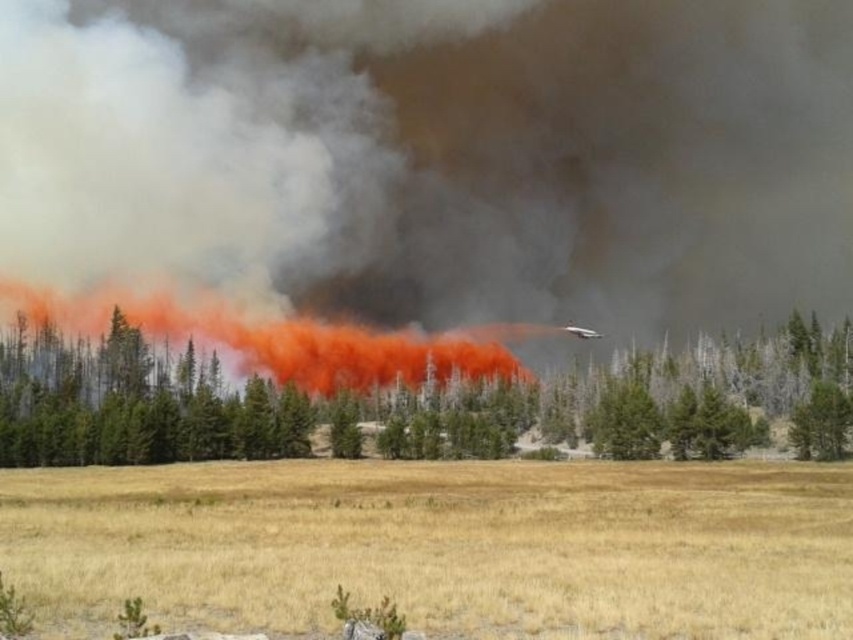
You are a firefighter assessing the fire spread. You see the dry grass at lower center and the orange smoke at center. Which area has a wider spread?

The orange smoke at center has a wider spread than the dry grass at lower center because the dry grass at lower center is narrower in width according to the description.

You are a firefighter trying to navigate through the forest fire scene. You see a green matte tree at center and an orange smoke at center. Which object is positioned to the left?

The orange smoke at center is positioned to the left of the green matte tree at center.

You are a firefighter assessing the fire scene. You see the dry grass at lower center and the orange smoke at center. Which object is positioned lower in the image?

The dry grass at lower center is located below the orange smoke at center, so the dry grass at lower center is positioned lower in the image.